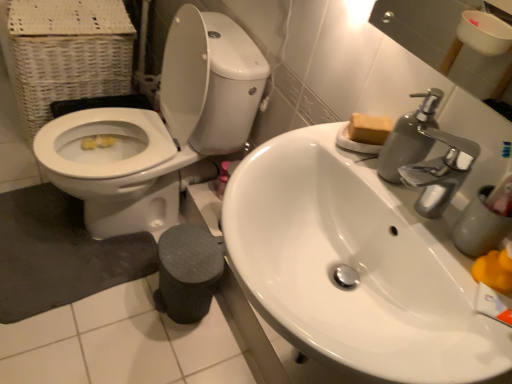
What do you see at coordinates (355, 266) in the screenshot?
I see `white glossy sink at upper right` at bounding box center [355, 266].

This screenshot has width=512, height=384. Describe the element at coordinates (480, 226) in the screenshot. I see `yellow plastic toy at sink right` at that location.

Find the location of a particular element. The width and height of the screenshot is (512, 384). metallic gray soap dispenser at upper right is located at coordinates (409, 137).

What do you see at coordinates (65, 52) in the screenshot? I see `white wicker basket at left` at bounding box center [65, 52].

The image size is (512, 384). What are the coordinates of `brown matte soap at upper right` in the screenshot? It's located at (369, 129).

You are a GUI agent. You are given a task and a screenshot of the screen. Output one action in this format:
    pyautogui.click(x=<x>, y=<y>)
    Task: Click on the white glossy sink at upper right
    This screenshot has height=384, width=512.
    Given the screenshot: What is the action you would take?
    (355, 266)

Based on the photo, is brown matte soap at upper right wider or thinner than yellow plastic toy at sink right?

In the image, brown matte soap at upper right appears to be wider than yellow plastic toy at sink right.

Is yellow plastic toy at sink right a part of brown matte soap at upper right?

No.

Which object is positioned more to the left, brown matte soap at upper right or yellow plastic toy at sink right?

brown matte soap at upper right is more to the left.

From the image's perspective, is white wicker basket at left located above or below dark gray textured bath mat at lower left?

white wicker basket at left is above dark gray textured bath mat at lower left.

Which of these two, white wicker basket at left or dark gray textured bath mat at lower left, stands shorter?

dark gray textured bath mat at lower left.

Is dark gray textured bath mat at lower left at the back of white wicker basket at left?

No, white wicker basket at left's orientation is not away from dark gray textured bath mat at lower left.

Choose the correct answer: Is white wicker basket at left inside dark gray textured bath mat at lower left or outside it?

white wicker basket at left is located beyond the bounds of dark gray textured bath mat at lower left.

From the picture: Is yellow plastic toy at sink right oriented away from brown matte soap at upper right?

No, yellow plastic toy at sink right is not facing away from brown matte soap at upper right.

Is yellow plastic toy at sink right touching brown matte soap at upper right?

They are not placed beside each other.

From the image's perspective, which is below, yellow plastic toy at sink right or brown matte soap at upper right?

From the image's view, yellow plastic toy at sink right is below.

Can you tell me how much yellow plastic toy at sink right and brown matte soap at upper right differ in facing direction?

yellow plastic toy at sink right and brown matte soap at upper right are facing 65.8 degrees away from each other.

Between point (364, 142) and point (425, 182), which one is positioned in front?

The point (425, 182) is in front.

Does brown matte soap at upper right have a greater width compared to silver metallic faucet at upper right?

In fact, brown matte soap at upper right might be narrower than silver metallic faucet at upper right.

Find the location of a particular element. tap in front of the brown matte soap at upper right is located at coordinates (440, 172).

Is brown matte soap at upper right to the left of metallic gray soap dispenser at upper right from the viewer's perspective?

Yes, brown matte soap at upper right is to the left of metallic gray soap dispenser at upper right.

Considering the relative sizes of brown matte soap at upper right and metallic gray soap dispenser at upper right in the image provided, is brown matte soap at upper right thinner than metallic gray soap dispenser at upper right?

Yes, brown matte soap at upper right is thinner than metallic gray soap dispenser at upper right.

Could you tell me if brown matte soap at upper right is facing metallic gray soap dispenser at upper right?

Yes, brown matte soap at upper right faces towards metallic gray soap dispenser at upper right.

Is metallic gray soap dispenser at upper right completely or partially inside brown matte soap at upper right?

No, metallic gray soap dispenser at upper right is not a part of brown matte soap at upper right.

From a real-world perspective, is yellow plastic toy at sink right under white glossy toilet at left?

No, from a real-world perspective, yellow plastic toy at sink right is not beneath white glossy toilet at left.

Is yellow plastic toy at sink right positioned with its back to white glossy toilet at left?

yellow plastic toy at sink right does not have its back to white glossy toilet at left.

From the picture: Considering their positions, is yellow plastic toy at sink right located in front of or behind white glossy toilet at left?

yellow plastic toy at sink right is positioned closer to the viewer than white glossy toilet at left.

Does yellow plastic toy at sink right have a greater width compared to white glossy toilet at left?

No.

From the image's perspective, which one is positioned higher, white wicker basket at left or metallic gray soap dispenser at upper right?

white wicker basket at left, from the image's perspective.

Who is shorter, white wicker basket at left or metallic gray soap dispenser at upper right?

Standing shorter between the two is metallic gray soap dispenser at upper right.

Is white wicker basket at left beside metallic gray soap dispenser at upper right?

No.

Is white wicker basket at left oriented away from metallic gray soap dispenser at upper right?

No, white wicker basket at left is not facing the opposite direction of metallic gray soap dispenser at upper right.

Identify the location of toiletry that is below the brown matte soap at upper right (from the image's perspective). (480, 226).

Find the location of a particular element. basket positioned vertically above the dark gray textured bath mat at lower left (from a real-world perspective) is located at coordinates (65, 52).

When comparing their distances from yellow plastic toy at sink right, does brown matte soap at upper right or dark gray textured bath mat at lower left seem further?

dark gray textured bath mat at lower left is positioned further to the anchor yellow plastic toy at sink right.

Estimate the real-world distances between objects in this image. Which object is closer to white glossy sink at upper right, white glossy toilet at left or metallic gray soap dispenser at upper right?

metallic gray soap dispenser at upper right.

When comparing their distances from dark gray textured bath mat at lower left, does metallic gray soap dispenser at upper right or white glossy toilet at left seem closer?

white glossy toilet at left lies closer to dark gray textured bath mat at lower left than the other object.

Considering their positions, is brown matte soap at upper right positioned further to metallic gray soap dispenser at upper right than dark gray textured bath mat at lower left?

dark gray textured bath mat at lower left lies further to metallic gray soap dispenser at upper right than the other object.

From the image, which object appears to be farther from silver metallic faucet at upper right, white wicker basket at left or white glossy sink at upper right?

white wicker basket at left is further to silver metallic faucet at upper right.

Based on their spatial positions, is yellow plastic toy at sink right or brown matte soap at upper right closer to dark gray textured bath mat at lower left?

brown matte soap at upper right is positioned closer to the anchor dark gray textured bath mat at lower left.

Which object lies nearer to the anchor point yellow plastic toy at sink right, dark gray textured bath mat at lower left or white wicker basket at left?

dark gray textured bath mat at lower left is closer to yellow plastic toy at sink right.

Considering their positions, is silver metallic faucet at upper right positioned closer to brown matte soap at upper right than white glossy sink at upper right?

silver metallic faucet at upper right lies closer to brown matte soap at upper right than the other object.

You are a GUI agent. You are given a task and a screenshot of the screen. Output one action in this format:
    pyautogui.click(x=<x>, y=<y>)
    Task: Click on the tap between white glossy sink at upper right and brown matte soap at upper right in the front-back direction
    This screenshot has height=384, width=512.
    Given the screenshot: What is the action you would take?
    pyautogui.click(x=440, y=172)

Where is `toilet between white wicker basket at left and silver metallic faucet at upper right in the horizontal direction`? The width and height of the screenshot is (512, 384). toilet between white wicker basket at left and silver metallic faucet at upper right in the horizontal direction is located at coordinates (160, 128).

Where is `tap between white wicker basket at left and yellow plastic toy at sink right`? tap between white wicker basket at left and yellow plastic toy at sink right is located at coordinates (440, 172).

I want to click on sink located between white glossy toilet at left and brown matte soap at upper right in the left-right direction, so click(355, 266).